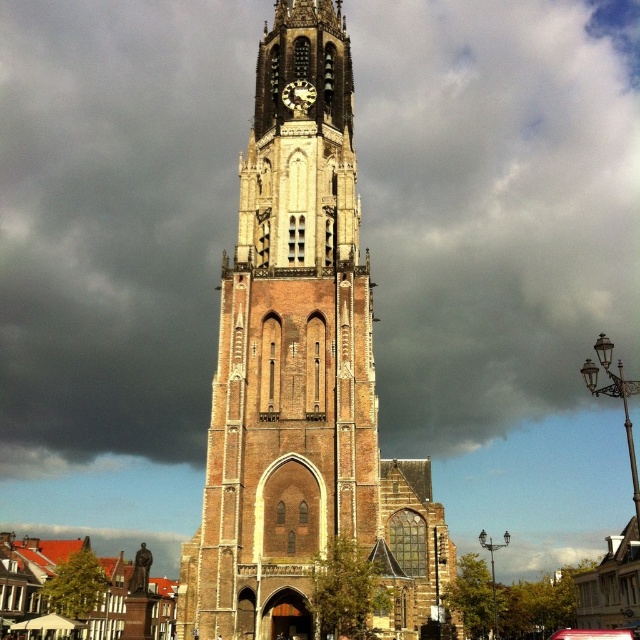
Between brown brick tower at center and wooden clock face at center, which one appears on the left side from the viewer's perspective?

Positioned to the left is wooden clock face at center.

Is brown brick tower at center below wooden clock face at center?

Indeed, brown brick tower at center is positioned under wooden clock face at center.

Does point (268, 307) come closer to viewer compared to point (291, 99)?

Yes.

This screenshot has width=640, height=640. I want to click on brown brick tower at center, so click(x=301, y=376).